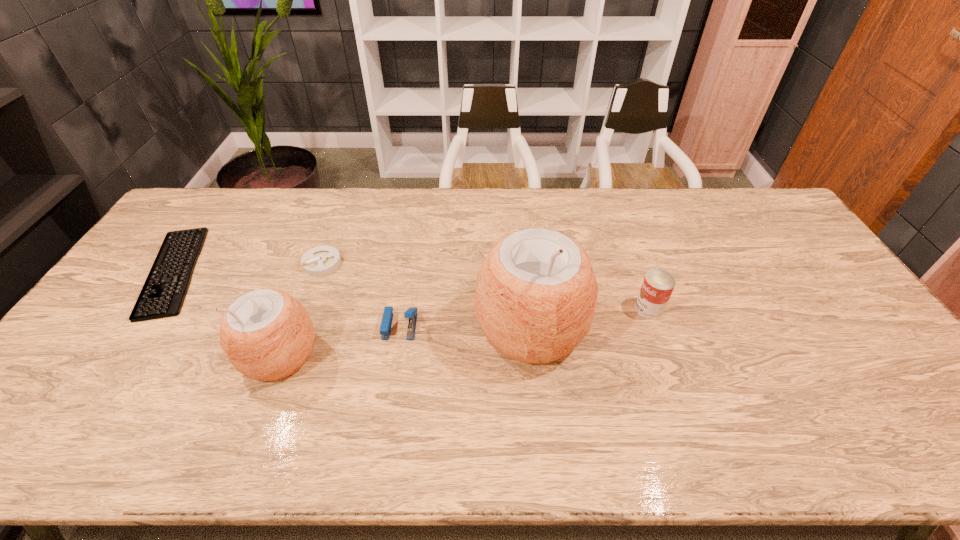
Given the evenly spaced coconuts in the image, where should an extra coconut be added on the right to preserve the spacing? Please point to a vacant space. Please provide its 2D coordinates. Your answer should be formatted as a tuple, i.e. [(x, y)], where the tuple contains the x and y coordinates of a point satisfying the conditions above.

[(757, 303)]